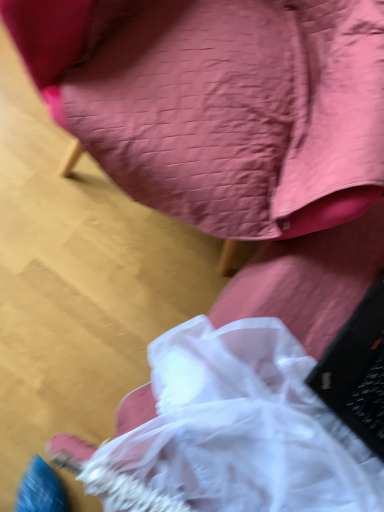
Question: Is matte pink fabric chair at upper center completely or partially inside black matte laptop at lower right?

Choices:
 (A) no
 (B) yes

Answer: (A)

Question: From a real-world perspective, is black matte laptop at lower right physically above matte pink fabric chair at upper center?

Choices:
 (A) no
 (B) yes

Answer: (A)

Question: Can you confirm if black matte laptop at lower right is wider than matte pink fabric chair at upper center?

Choices:
 (A) yes
 (B) no

Answer: (B)

Question: Is black matte laptop at lower right at the right side of matte pink fabric chair at upper center?

Choices:
 (A) no
 (B) yes

Answer: (B)

Question: Is black matte laptop at lower right completely or partially outside of matte pink fabric chair at upper center?

Choices:
 (A) yes
 (B) no

Answer: (A)

Question: Is black matte laptop at lower right to the left of matte pink fabric chair at upper center from the viewer's perspective?

Choices:
 (A) no
 (B) yes

Answer: (A)

Question: Is matte pink fabric chair at upper center at the right side of black matte laptop at lower right?

Choices:
 (A) yes
 (B) no

Answer: (B)

Question: Does matte pink fabric chair at upper center appear on the left side of black matte laptop at lower right?

Choices:
 (A) no
 (B) yes

Answer: (B)

Question: From the image's perspective, would you say matte pink fabric chair at upper center is positioned over black matte laptop at lower right?

Choices:
 (A) yes
 (B) no

Answer: (A)

Question: Is matte pink fabric chair at upper center in front of black matte laptop at lower right?

Choices:
 (A) yes
 (B) no

Answer: (A)

Question: Considering the relative sizes of matte pink fabric chair at upper center and black matte laptop at lower right in the image provided, is matte pink fabric chair at upper center taller than black matte laptop at lower right?

Choices:
 (A) yes
 (B) no

Answer: (A)

Question: Is matte pink fabric chair at upper center further to the viewer compared to black matte laptop at lower right?

Choices:
 (A) yes
 (B) no

Answer: (B)

Question: Is point (359, 351) closer or farther from the camera than point (274, 228)?

Choices:
 (A) farther
 (B) closer

Answer: (B)